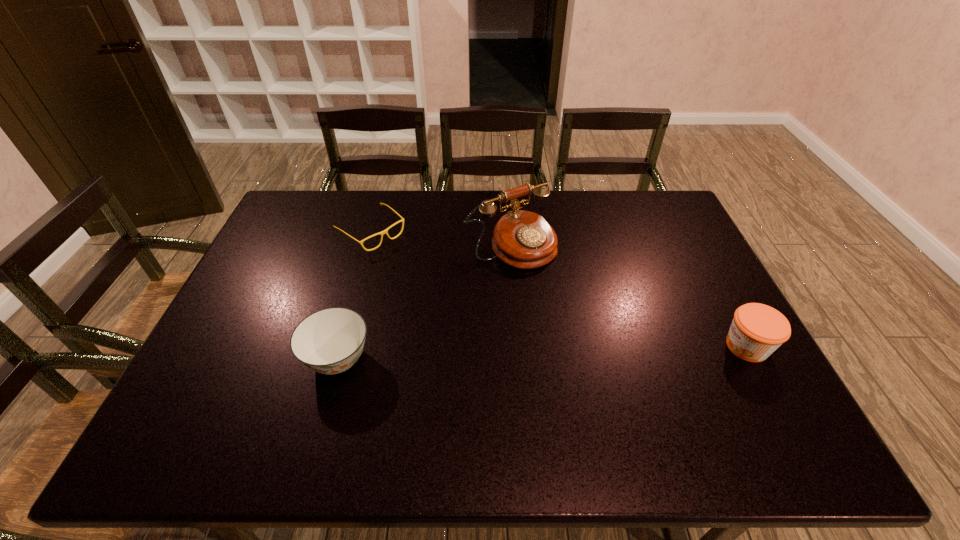
At what (x,y) coordinates should I click in order to perform the action: click on soup bowl. Please return your answer as a coordinate pair (x, y). Looking at the image, I should click on (330, 341).

Image resolution: width=960 pixels, height=540 pixels. I want to click on jam, so click(x=757, y=330).

At what (x,y) coordinates should I click in order to perform the action: click on spectacles. Please return your answer as a coordinate pair (x, y). Image resolution: width=960 pixels, height=540 pixels. Looking at the image, I should click on (382, 233).

At what (x,y) coordinates should I click in order to perform the action: click on the tallest object. Please return your answer as a coordinate pair (x, y). This screenshot has width=960, height=540. Looking at the image, I should click on (522, 239).

The image size is (960, 540). In order to click on the third object from left to right in this screenshot , I will do tap(522, 239).

Where is `vacant region located on the right of the soup bowl`? vacant region located on the right of the soup bowl is located at coordinates (468, 359).

Locate an element on the screen. vacant space situated on the front label of the jam is located at coordinates (664, 346).

Identify the location of vacant space located 0.140m on the front label of the jam. This screenshot has width=960, height=540. (668, 346).

Locate an element on the screen. Image resolution: width=960 pixels, height=540 pixels. vacant point located on the front label of the jam is located at coordinates tap(567, 346).

The image size is (960, 540). What are the coordinates of `free space located 0.390m in front of the lenses of the shortest object` in the screenshot? It's located at (476, 313).